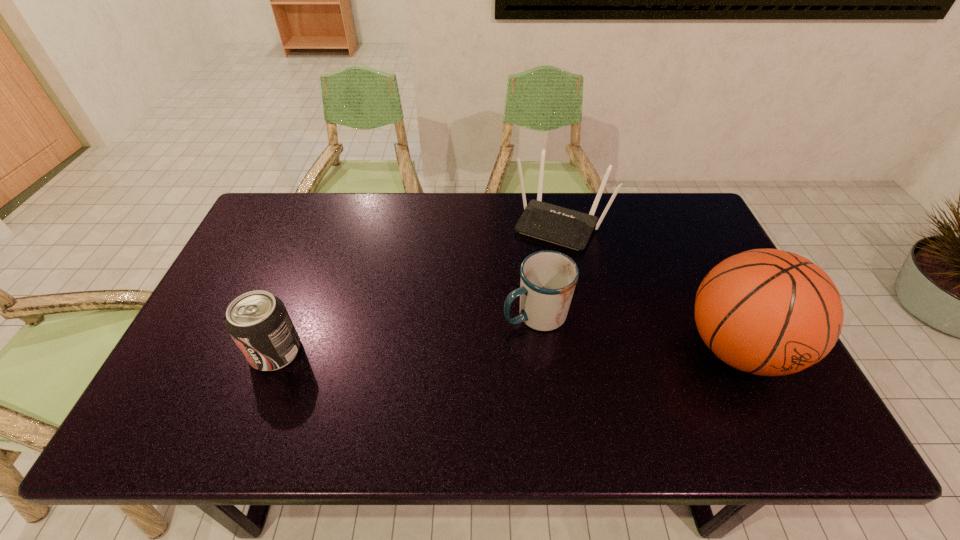
You are a GUI agent. You are given a task and a screenshot of the screen. Output one action in this format:
    pyautogui.click(x=<x>, y=<y>)
    Task: Click on the blank space located on the handle side of the mug
    The width and height of the screenshot is (960, 540).
    Given the screenshot: What is the action you would take?
    pyautogui.click(x=454, y=357)

What are the coordinates of `vacant area situated 0.210m on the handle side of the mug` in the screenshot? It's located at (441, 366).

This screenshot has height=540, width=960. I want to click on vacant space located on the handle side of the mug, so click(x=474, y=346).

Where is `object that is at the far edge`? This screenshot has width=960, height=540. object that is at the far edge is located at coordinates (569, 228).

The width and height of the screenshot is (960, 540). I want to click on soda can located in the near edge section of the desktop, so point(258,322).

Find the location of `basketball present at the near edge`. basketball present at the near edge is located at coordinates tap(769, 312).

Identify the location of object that is positioned at the left edge. (258, 322).

The height and width of the screenshot is (540, 960). Find the location of `object that is at the right edge`. object that is at the right edge is located at coordinates (769, 312).

The width and height of the screenshot is (960, 540). What are the coordinates of `object located at the near left corner` in the screenshot? It's located at (258, 322).

The image size is (960, 540). Find the location of `object located in the near right corner section of the desktop`. object located in the near right corner section of the desktop is located at coordinates (769, 312).